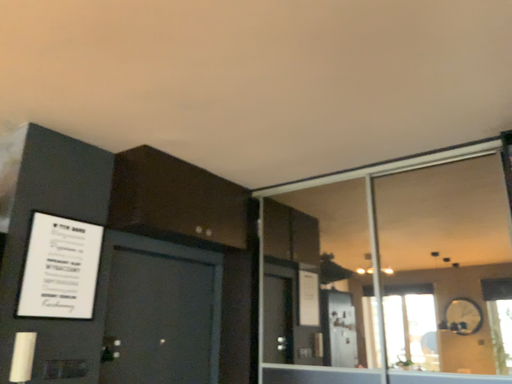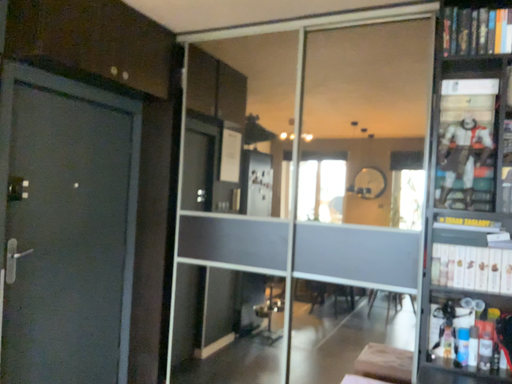
Question: Which way did the camera rotate in the video?

Choices:
 (A) rotated left
 (B) rotated right

Answer: (B)